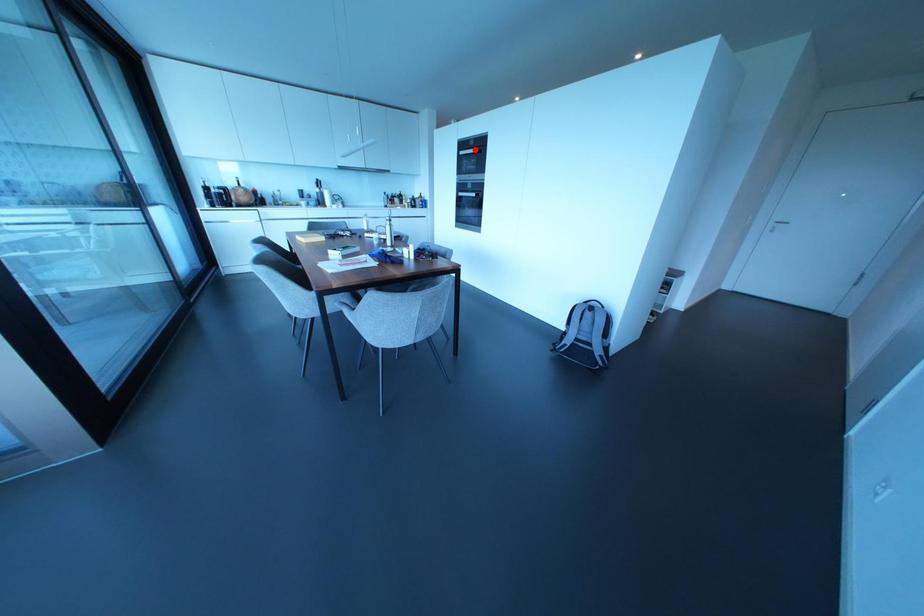
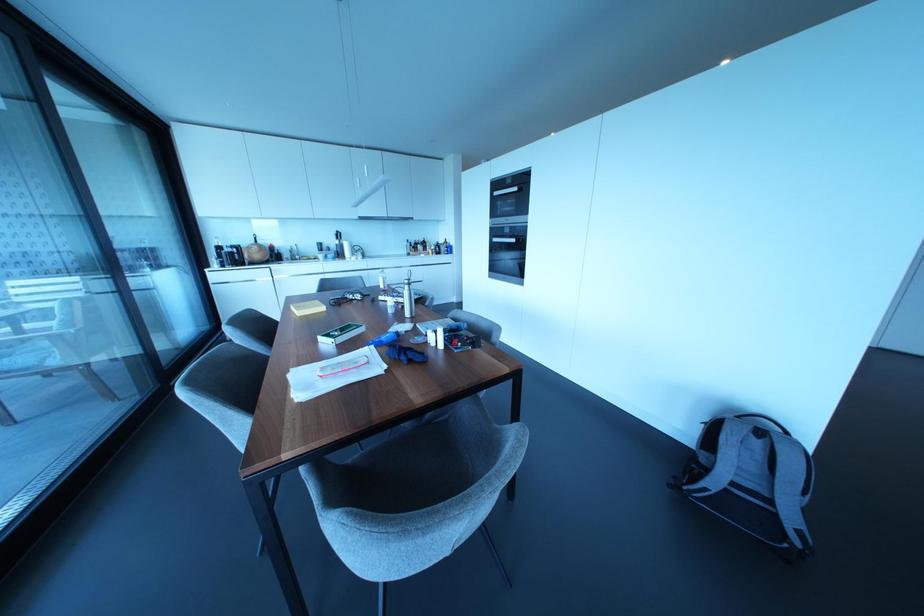
Where in the second image is the point corresponding to the highlighted location from the first image?

(515, 188)